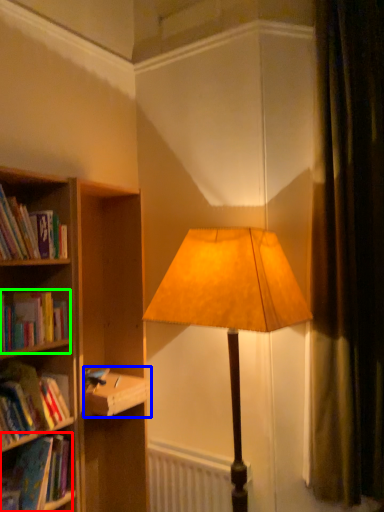
Question: Which object is the closest to the book (highlighted by a red box)? Choose among these: paperback book (highlighted by a blue box) or book (highlighted by a green box).

Choices:
 (A) paperback book
 (B) book

Answer: (A)